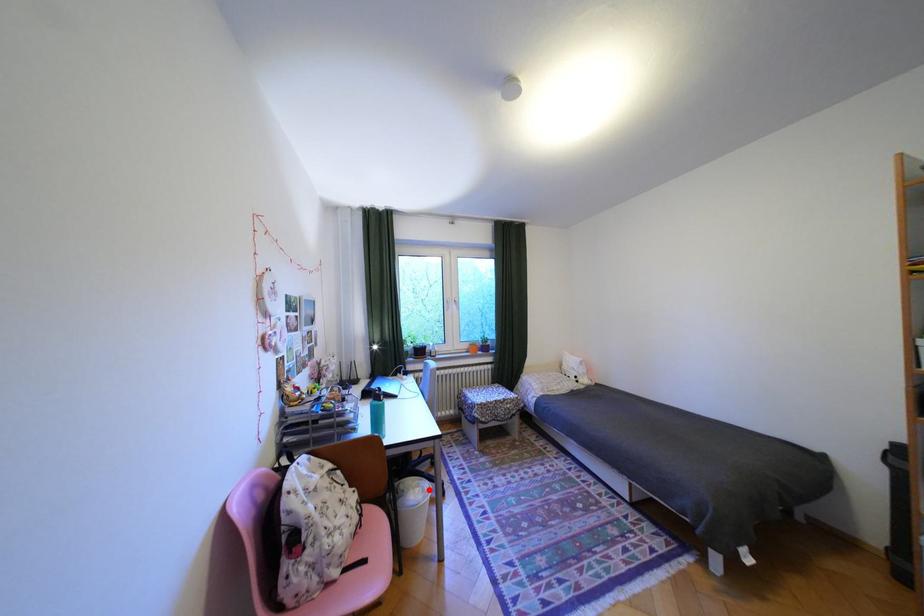
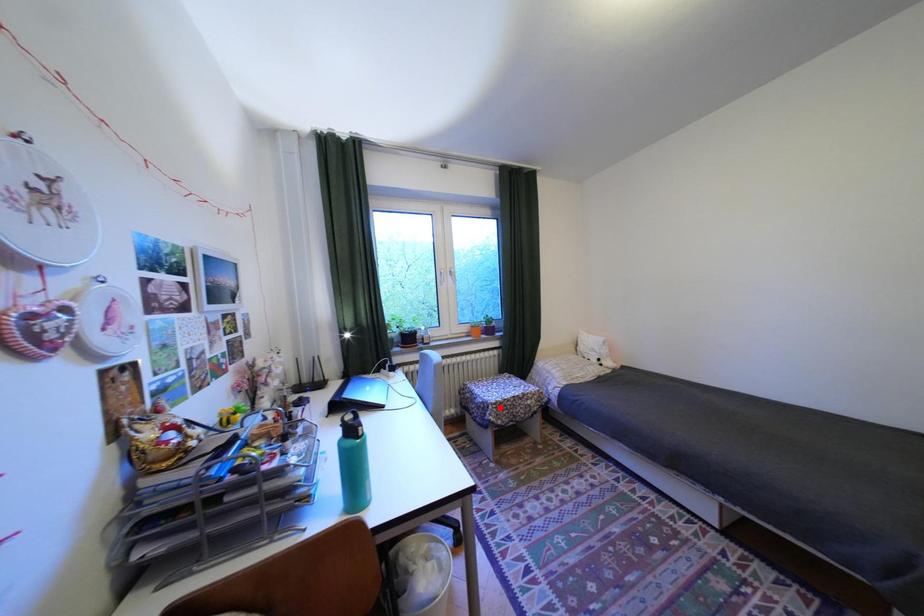
I am providing you with two images of the same scene from different viewpoints. A red point is marked on the first image and another point is marked on the second image. Does the point marked in image1 correspond to the same location as the one in image2?

No